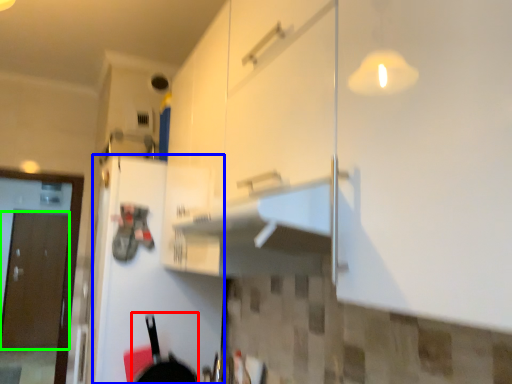
Question: Which is farther away from frying pan (highlighted by a red box)? door (highlighted by a blue box) or door (highlighted by a green box)?

Choices:
 (A) door
 (B) door

Answer: (B)